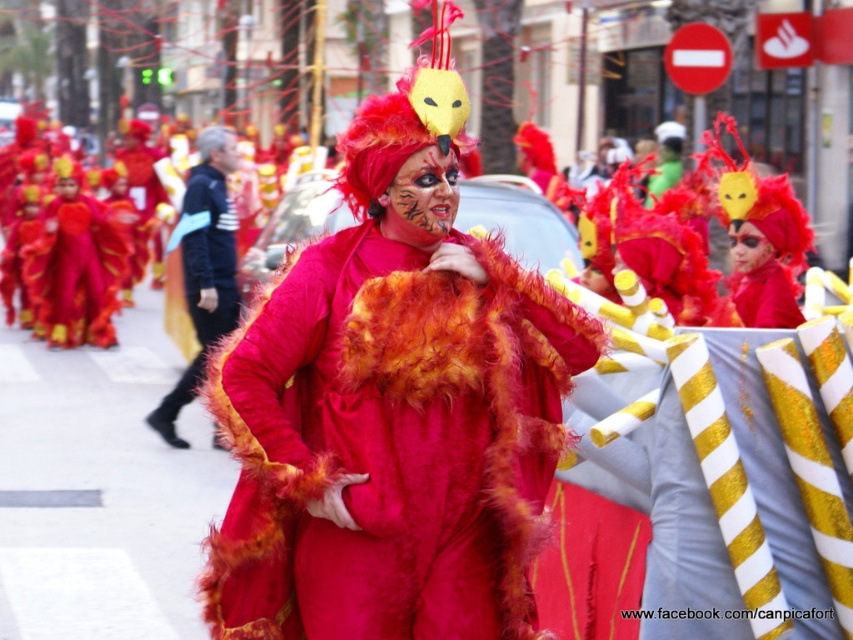
Question: Which object is positioned farthest from the fuzzy red costume at center?

Choices:
 (A) velvet red costume at center
 (B) matte black jacket at center

Answer: (A)

Question: Estimate the real-world distances between objects in this image. Which object is closer to the matte black jacket at center?

Choices:
 (A) fuzzy red costume at center
 (B) velvet red costume at center

Answer: (B)

Question: Can you confirm if fuzzy red costume at center is thinner than matte black jacket at center?

Choices:
 (A) yes
 (B) no

Answer: (B)

Question: Estimate the real-world distances between objects in this image. Which object is farther from the fuzzy red costume at center?

Choices:
 (A) matte black jacket at center
 (B) velvet red costume at center

Answer: (B)

Question: Can you confirm if fuzzy red costume at center is thinner than matte black jacket at center?

Choices:
 (A) yes
 (B) no

Answer: (B)

Question: Is fuzzy red costume at center below matte black jacket at center?

Choices:
 (A) yes
 (B) no

Answer: (A)